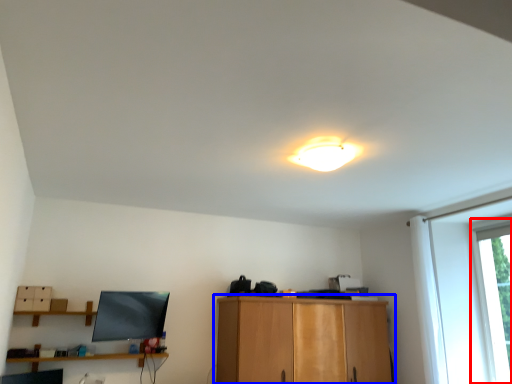
Question: Which of the following is the farthest to the observer, window (highlighted by a red box) or cabinetry (highlighted by a blue box)?

Choices:
 (A) window
 (B) cabinetry

Answer: (B)